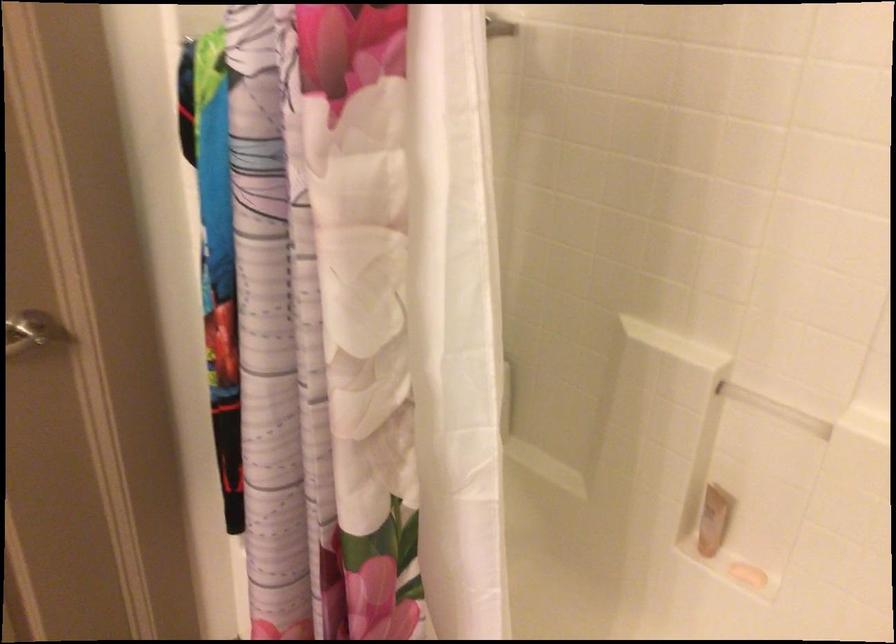
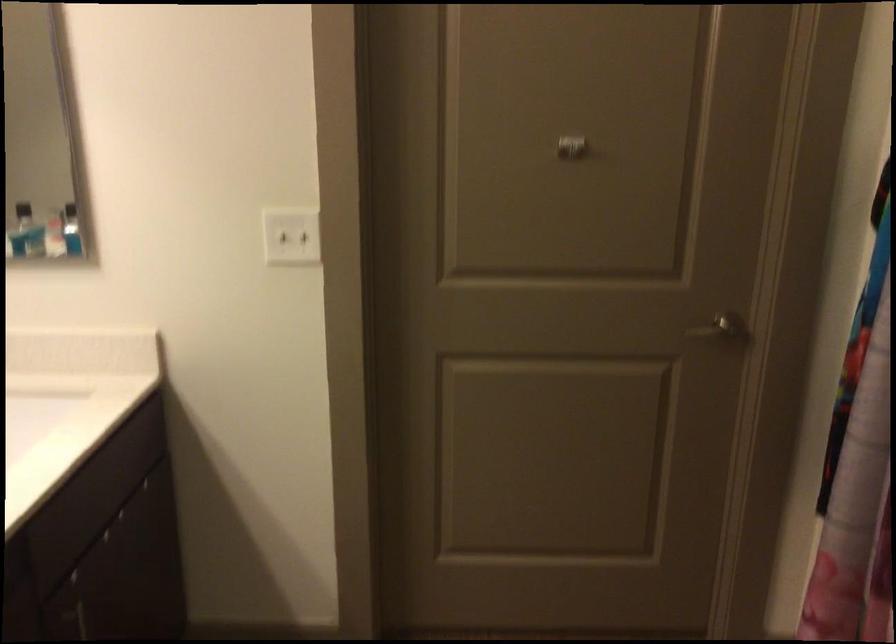
Question: The images are taken continuously from a first-person perspective. In which direction is your viewpoint rotating?

Choices:
 (A) Left
 (B) Right
 (C) Up
 (D) Down

Answer: (A)